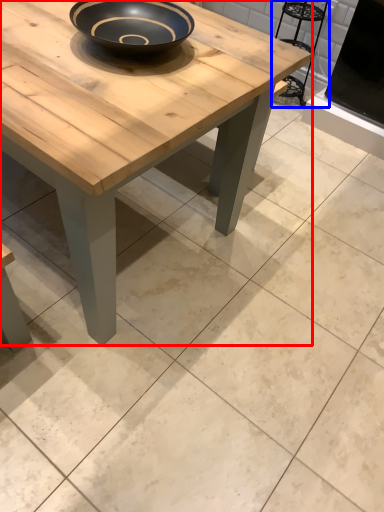
Question: Which object is further to the camera taking this photo, coffee table (highlighted by a red box) or chair (highlighted by a blue box)?

Choices:
 (A) coffee table
 (B) chair

Answer: (B)